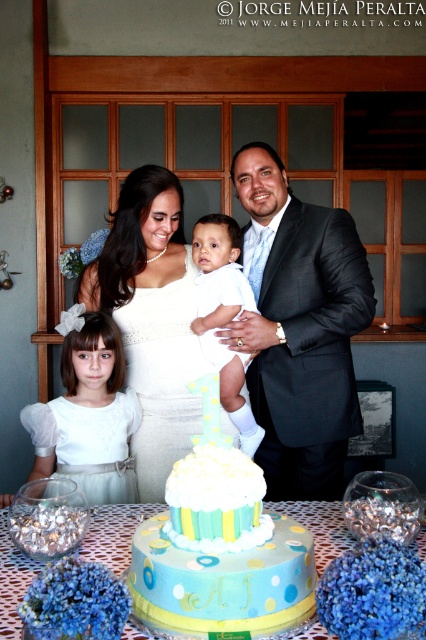
You are taking a photo of the family celebration scene described. You want to focus on the point at position (307, 304) first and then shift focus to the point at (172, 209). Will the camera need to adjust its focus distance when moving from the first point to the second?

Yes, the camera will need to adjust its focus distance because point (307, 304) is closer to the camera than point (172, 209). When shifting focus from a closer object to a farther one, the focus distance must be changed.